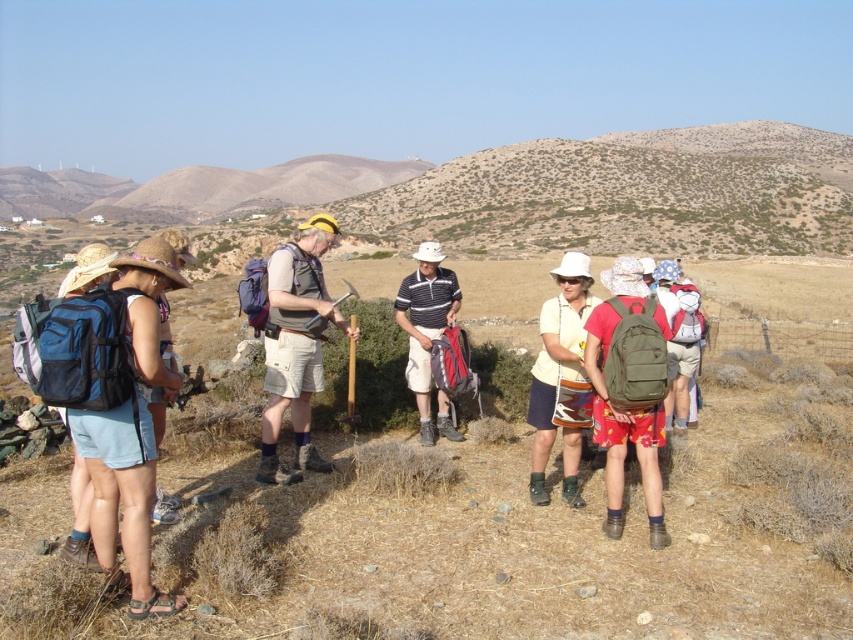
Is blue fabric backpack at left shorter than olive green fabric backpack at center-right?

No.

Is point (96, 468) positioned after point (621, 445)?

No, it is not.

You are a GUI agent. You are given a task and a screenshot of the screen. Output one action in this format:
    pyautogui.click(x=<x>, y=<y>)
    Task: Click on the blue fabric backpack at left
    The image size is (853, 640).
    Given the screenshot: What is the action you would take?
    pyautogui.click(x=123, y=493)

Consider the image. Who is taller, matte gray vest at center or striped polo shirt at center?

matte gray vest at center

Can you confirm if matte gray vest at center is wider than striped polo shirt at center?

Yes.

Which is behind, point (302, 352) or point (409, 307)?

The point (409, 307) is behind.

Find the location of a particular element. matte gray vest at center is located at coordinates (296, 346).

Is matte gray vest at center bigger than matte yellow shirt at center?

Yes.

Between point (305, 396) and point (548, 392), which one is positioned behind?

The point (305, 396) is more distant.

At what (x,y) coordinates should I click in order to perform the action: click on matte gray vest at center. Please return your answer as a coordinate pair (x, y). The height and width of the screenshot is (640, 853). Looking at the image, I should click on (296, 346).